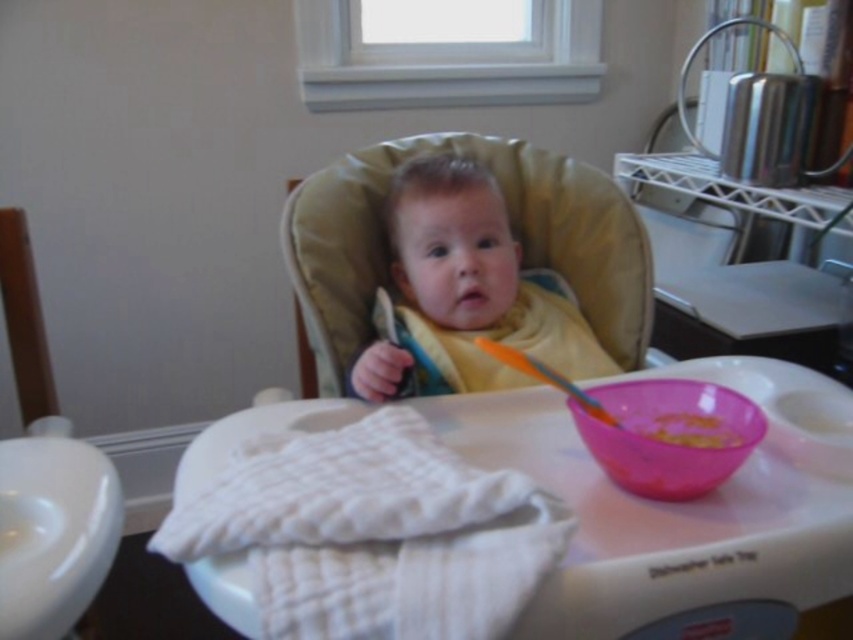
How distant is yellow matte food at center from orange plastic spoon at upper center?

yellow matte food at center and orange plastic spoon at upper center are 4.97 inches apart from each other.

Can you confirm if yellow matte food at center is positioned below orange plastic spoon at upper center?

Yes.

In order to click on yellow matte food at center in this screenshot , I will do `click(685, 429)`.

Between point (674, 404) and point (503, 349), which one is positioned in front?

Point (503, 349)

In order to click on pink plastic bowl at lower center in this screenshot , I will do `click(669, 435)`.

Who is higher up, white fabric at lower left or pink plastic bowl at lower center?

pink plastic bowl at lower center is higher up.

Locate an element on the screen. The width and height of the screenshot is (853, 640). white fabric at lower left is located at coordinates (53, 532).